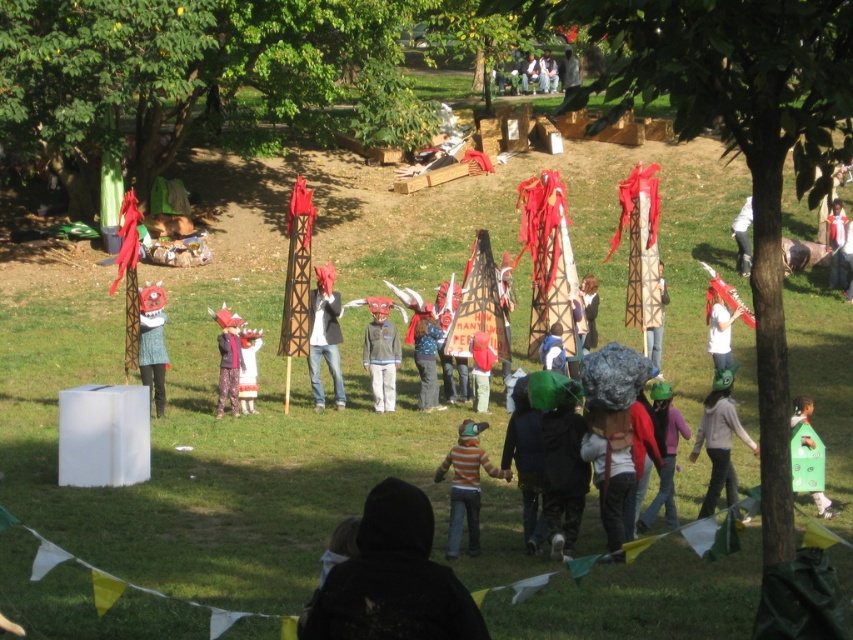
What do you see at coordinates (228, 358) in the screenshot?
I see `matte pink fabric at center` at bounding box center [228, 358].

Who is higher up, matte pink fabric at center or white matte shirt at center?

white matte shirt at center

Find the location of a particular element. matte pink fabric at center is located at coordinates click(228, 358).

Is striped cotton shirt at center below matte pink fabric at center?

Indeed, striped cotton shirt at center is positioned under matte pink fabric at center.

Does point (473, 464) come farther from viewer compared to point (218, 417)?

No, (473, 464) is in front of (218, 417).

Does point (457, 464) come behind point (225, 316)?

No, it is not.

Locate an element on the screen. The image size is (853, 640). striped cotton shirt at center is located at coordinates (466, 484).

Can you confirm if gray matte jacket at center is positioned to the right of white matte shirt at center?

Incorrect, gray matte jacket at center is not on the right side of white matte shirt at center.

Which is behind, point (383, 298) or point (717, 333)?

The point (383, 298) is more distant.

Find the location of a particular element. This screenshot has height=640, width=853. gray matte jacket at center is located at coordinates (381, 353).